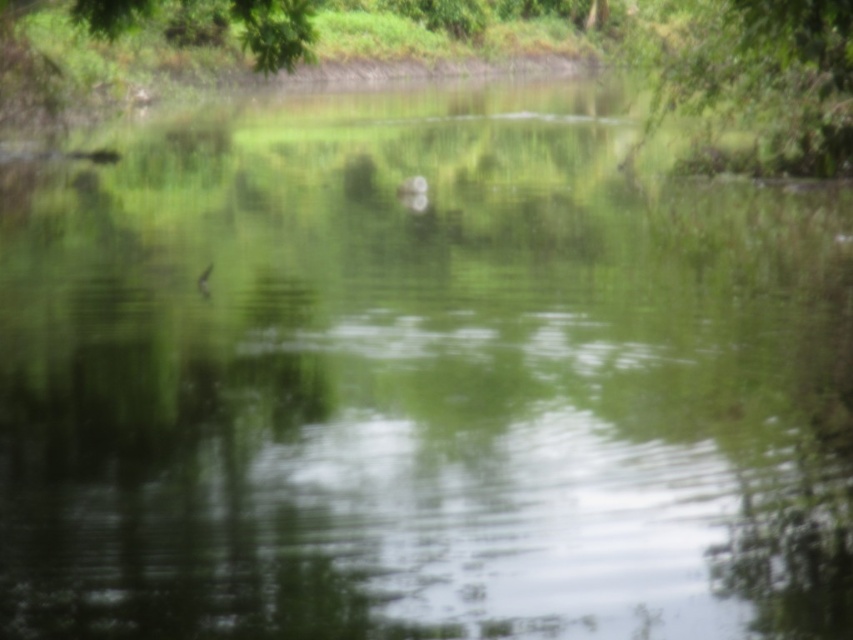
Is point (686, 24) positioned before point (312, 40)?

No, it is behind (312, 40).

Can you confirm if green leafy tree at upper right is smaller than green leafy tree at upper left?

Indeed, green leafy tree at upper right has a smaller size compared to green leafy tree at upper left.

This screenshot has width=853, height=640. Find the location of `green leafy tree at upper right`. green leafy tree at upper right is located at coordinates coord(757,77).